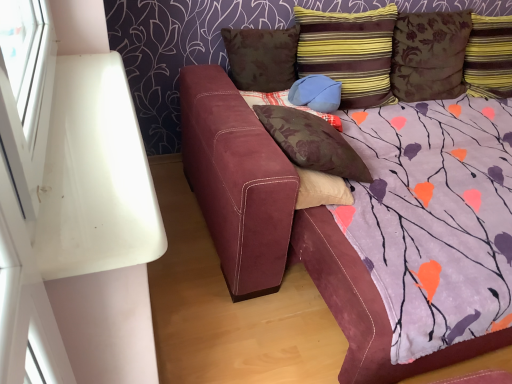
Question: From a real-world perspective, is striped fabric pillow at upper right, which appears as the fourth pillow when viewed from the left, below brown floral pillow at upper center, positioned as the sixth pillow in right-to-left order?

Choices:
 (A) yes
 (B) no

Answer: (B)

Question: Considering the relative positions of striped fabric pillow at upper right, which appears as the fourth pillow when viewed from the left, and brown floral pillow at upper center, positioned as the sixth pillow in right-to-left order, in the image provided, is striped fabric pillow at upper right, which appears as the fourth pillow when viewed from the left, to the left of brown floral pillow at upper center, positioned as the sixth pillow in right-to-left order, from the viewer's perspective?

Choices:
 (A) no
 (B) yes

Answer: (A)

Question: Is striped fabric pillow at upper right, which appears as the fourth pillow when viewed from the left, aimed at brown floral pillow at upper center, the 1th pillow positioned from the left?

Choices:
 (A) no
 (B) yes

Answer: (A)

Question: Is striped fabric pillow at upper right, which appears as the fourth pillow when viewed from the left, positioned with its back to brown floral pillow at upper center, positioned as the sixth pillow in right-to-left order?

Choices:
 (A) yes
 (B) no

Answer: (B)

Question: Considering the relative sizes of striped fabric pillow at upper right, which appears as the fourth pillow when viewed from the left, and brown floral pillow at upper center, the 1th pillow positioned from the left, in the image provided, is striped fabric pillow at upper right, which appears as the fourth pillow when viewed from the left, wider than brown floral pillow at upper center, the 1th pillow positioned from the left,?

Choices:
 (A) no
 (B) yes

Answer: (B)

Question: Based on their positions, is brown floral pillow at upper center, positioned as the sixth pillow in right-to-left order, located to the left or right of striped fabric pillow at upper right, the 3th pillow viewed from the right?

Choices:
 (A) right
 (B) left

Answer: (B)

Question: Does point (284, 84) appear closer or farther from the camera than point (298, 13)?

Choices:
 (A) farther
 (B) closer

Answer: (A)

Question: From the image's perspective, relative to striped fabric pillow at upper right, the 3th pillow viewed from the right, is brown floral pillow at upper center, the 1th pillow positioned from the left, above or below?

Choices:
 (A) below
 (B) above

Answer: (A)

Question: Considering the positions of brown floral pillow at upper center, the 1th pillow positioned from the left, and striped fabric pillow at upper right, which appears as the fourth pillow when viewed from the left, in the image, is brown floral pillow at upper center, the 1th pillow positioned from the left, bigger or smaller than striped fabric pillow at upper right, which appears as the fourth pillow when viewed from the left,?

Choices:
 (A) big
 (B) small

Answer: (B)

Question: Which is correct: striped fabric pillow at upper right, the sixth pillow positioned from the left, is inside suede blue pillow at center, the third pillow when ordered from left to right, or outside of it?

Choices:
 (A) inside
 (B) outside

Answer: (B)

Question: From the image's perspective, is striped fabric pillow at upper right, the sixth pillow positioned from the left, located above or below suede blue pillow at center, the third pillow when ordered from left to right?

Choices:
 (A) below
 (B) above

Answer: (B)

Question: Is striped fabric pillow at upper right, which appears as the first pillow when viewed from the right, to the left or to the right of suede blue pillow at center, the 4th pillow from the right, in the image?

Choices:
 (A) left
 (B) right

Answer: (B)

Question: In terms of width, does striped fabric pillow at upper right, the sixth pillow positioned from the left, look wider or thinner when compared to suede blue pillow at center, the third pillow when ordered from left to right?

Choices:
 (A) thin
 (B) wide

Answer: (B)

Question: Considering the positions of striped fabric pillow at upper right, which appears as the first pillow when viewed from the right, and striped fabric pillow at upper right, which appears as the fourth pillow when viewed from the left, in the image, is striped fabric pillow at upper right, which appears as the first pillow when viewed from the right, wider or thinner than striped fabric pillow at upper right, which appears as the fourth pillow when viewed from the left,?

Choices:
 (A) thin
 (B) wide

Answer: (A)

Question: Is striped fabric pillow at upper right, the sixth pillow positioned from the left, bigger or smaller than striped fabric pillow at upper right, which appears as the fourth pillow when viewed from the left?

Choices:
 (A) big
 (B) small

Answer: (B)